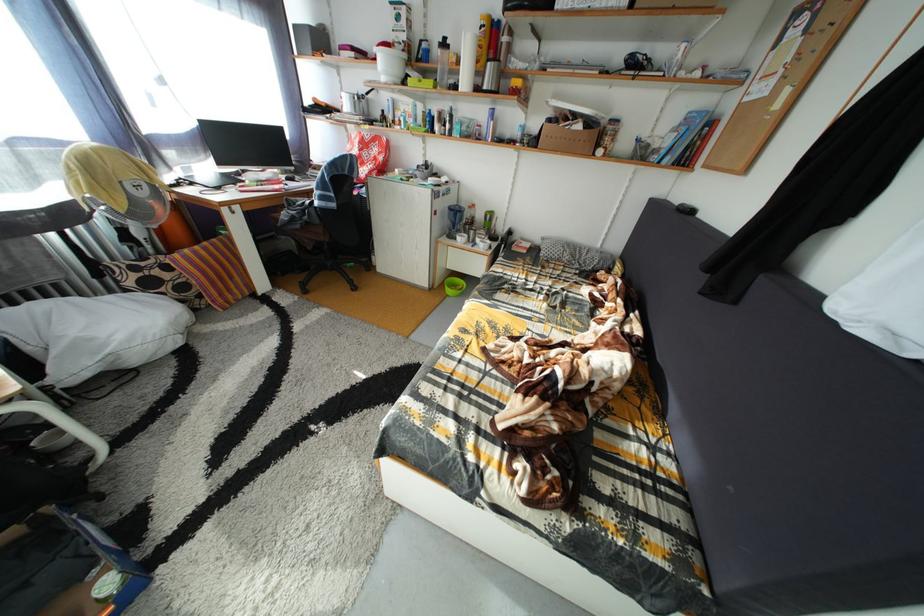
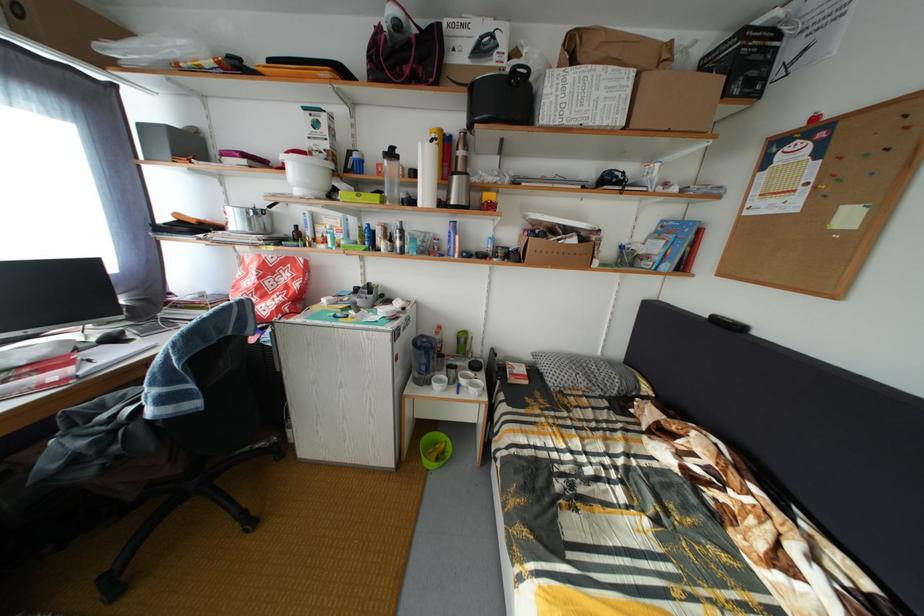
Question: How did the camera likely rotate?

Choices:
 (A) Left
 (B) Right
 (C) Up
 (D) Down

Answer: (B)